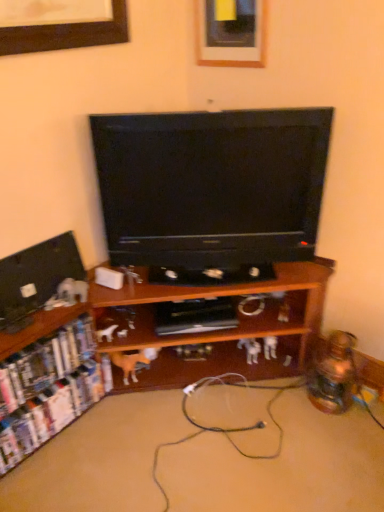
This screenshot has height=512, width=384. What are the coordinates of `vacant area situated to the left side of black rubber extension cord at lower center` in the screenshot? It's located at (154, 404).